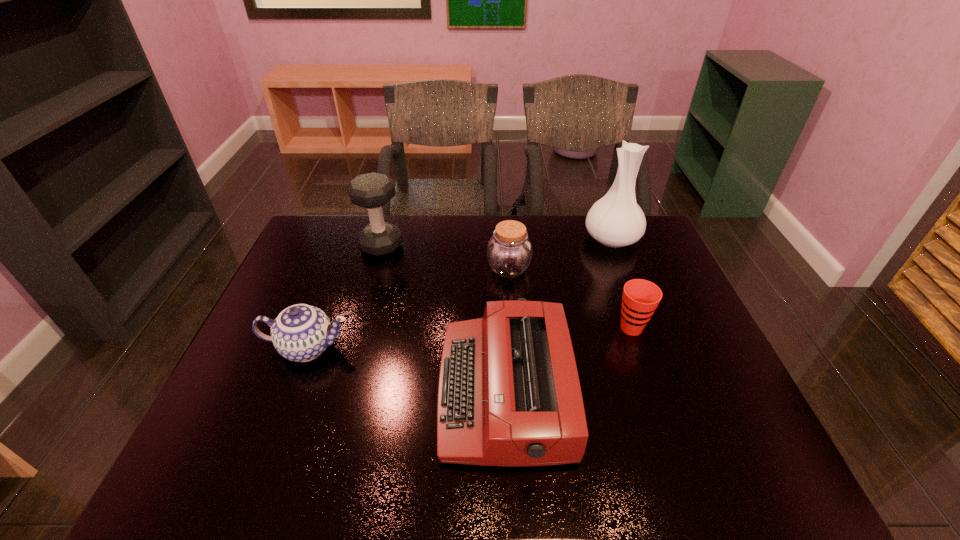
Where is `cup that is at the right edge`? Image resolution: width=960 pixels, height=540 pixels. cup that is at the right edge is located at coordinates (640, 298).

You are a GUI agent. You are given a task and a screenshot of the screen. Output one action in this format:
    pyautogui.click(x=<x>, y=<y>)
    Task: Click on the object located in the far right corner section of the desktop
    The width and height of the screenshot is (960, 540).
    Given the screenshot: What is the action you would take?
    pyautogui.click(x=616, y=220)

In the image, there is a desktop. Where is `vacant space at the far edge`? vacant space at the far edge is located at coordinates (477, 215).

This screenshot has width=960, height=540. Identify the location of vacant space at the near edge of the desktop. (536, 469).

At what (x,y) coordinates should I click in order to perform the action: click on blank space at the left edge of the desktop. Please return your answer as a coordinate pair (x, y). The width and height of the screenshot is (960, 540). Looking at the image, I should click on (x=307, y=289).

At what (x,y) coordinates should I click in order to perform the action: click on vacant space at the right edge of the desktop. Please return your answer as a coordinate pair (x, y). Looking at the image, I should click on (718, 360).

This screenshot has width=960, height=540. Identify the location of free point at the far left corner. (305, 231).

You are a GUI agent. You are given a task and a screenshot of the screen. Output one action in this format:
    pyautogui.click(x=<x>, y=<y>)
    Task: Click on the vacant point at the near left corner
    
    Given the screenshot: What is the action you would take?
    pyautogui.click(x=247, y=452)

The width and height of the screenshot is (960, 540). I want to click on vacant position at the near right corner of the desktop, so click(x=709, y=453).

At what (x,y) coordinates should I click in order to perform the action: click on empty space between the jar and the dumbbell. Please return your answer as a coordinate pair (x, y). This screenshot has width=960, height=540. Looking at the image, I should click on (445, 257).